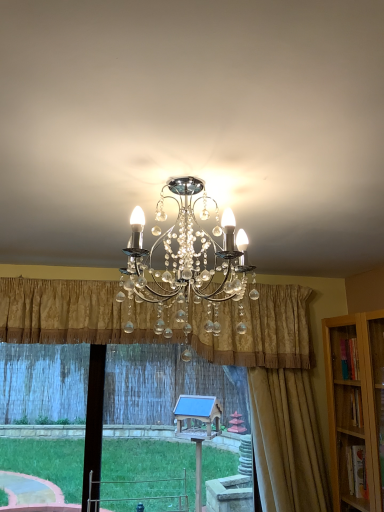
Question: Considering the relative sizes of gold textured curtain at center, marked as the 2th curtain in a right-to-left arrangement, and gold textured curtain at right, which ranks as the first curtain in right-to-left order, in the image provided, is gold textured curtain at center, marked as the 2th curtain in a right-to-left arrangement, wider than gold textured curtain at right, which ranks as the first curtain in right-to-left order,?

Choices:
 (A) yes
 (B) no

Answer: (A)

Question: Is gold textured curtain at center, marked as the 2th curtain in a right-to-left arrangement, not inside gold textured curtain at right, which ranks as the first curtain in right-to-left order?

Choices:
 (A) yes
 (B) no

Answer: (A)

Question: Is gold textured curtain at center, marked as the 2th curtain in a right-to-left arrangement, far from gold textured curtain at right, which ranks as the first curtain in right-to-left order?

Choices:
 (A) yes
 (B) no

Answer: (B)

Question: Does gold textured curtain at center, marked as the 2th curtain in a right-to-left arrangement, have a greater height compared to gold textured curtain at right, which is the 2th curtain from left to right?

Choices:
 (A) yes
 (B) no

Answer: (B)

Question: Does gold textured curtain at center, positioned as the first curtain in left-to-right order, have a lesser height compared to gold textured curtain at right, which ranks as the first curtain in right-to-left order?

Choices:
 (A) yes
 (B) no

Answer: (A)

Question: Looking at their shapes, would you say transparent glass window at center is wider or thinner than gold textured curtain at center, positioned as the first curtain in left-to-right order?

Choices:
 (A) thin
 (B) wide

Answer: (A)

Question: Relative to gold textured curtain at center, marked as the 2th curtain in a right-to-left arrangement, is transparent glass window at center in front or behind?

Choices:
 (A) behind
 (B) front

Answer: (A)

Question: Choose the correct answer: Is transparent glass window at center inside gold textured curtain at center, positioned as the first curtain in left-to-right order, or outside it?

Choices:
 (A) outside
 (B) inside

Answer: (A)

Question: From a real-world perspective, is transparent glass window at center above or below gold textured curtain at center, positioned as the first curtain in left-to-right order?

Choices:
 (A) above
 (B) below

Answer: (B)

Question: From a real-world perspective, is gold textured curtain at center, positioned as the first curtain in left-to-right order, positioned above or below transparent glass window at center?

Choices:
 (A) above
 (B) below

Answer: (A)

Question: Does point [x=140, y=334] appear closer or farther from the camera than point [x=195, y=384]?

Choices:
 (A) closer
 (B) farther

Answer: (A)

Question: In terms of width, does gold textured curtain at center, marked as the 2th curtain in a right-to-left arrangement, look wider or thinner when compared to transparent glass window at center?

Choices:
 (A) wide
 (B) thin

Answer: (A)

Question: Based on their positions, is gold textured curtain at center, positioned as the first curtain in left-to-right order, located to the left or right of transparent glass window at center?

Choices:
 (A) right
 (B) left

Answer: (B)

Question: Considering the positions of point (117, 390) and point (306, 443), is point (117, 390) closer or farther from the camera than point (306, 443)?

Choices:
 (A) closer
 (B) farther

Answer: (B)

Question: Do you think transparent glass window at center is within gold textured curtain at right, which ranks as the first curtain in right-to-left order, or outside of it?

Choices:
 (A) outside
 (B) inside

Answer: (A)